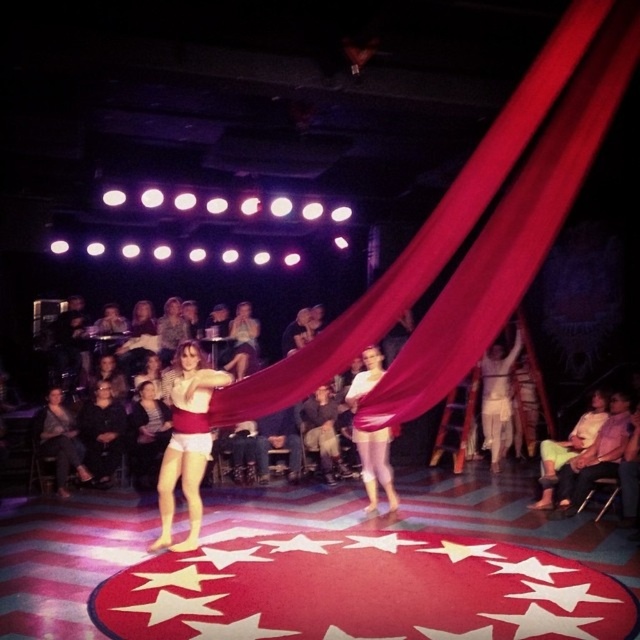
Is matte red shorts at center shorter than dark gray sweater at lower left?

No, matte red shorts at center is not shorter than dark gray sweater at lower left.

Does matte red shorts at center have a greater height compared to dark gray sweater at lower left?

Correct, matte red shorts at center is much taller as dark gray sweater at lower left.

Locate an element on the screen. The width and height of the screenshot is (640, 640). matte red shorts at center is located at coordinates (186, 444).

Between matte red shorts at center and dark gray fabric at center, which one is positioned lower?

dark gray fabric at center

What are the coordinates of `matte red shorts at center` in the screenshot? It's located at (186, 444).

Consider the image. Can you confirm if dark gray sweater at lower left is bigger than dark gray fabric at center?

No.

Can you confirm if dark gray sweater at lower left is positioned above dark gray fabric at center?

Yes, dark gray sweater at lower left is above dark gray fabric at center.

At what (x,y) coordinates should I click in order to perform the action: click on dark gray sweater at lower left. Please return your answer as a coordinate pair (x, y). This screenshot has height=640, width=640. Looking at the image, I should click on (102, 433).